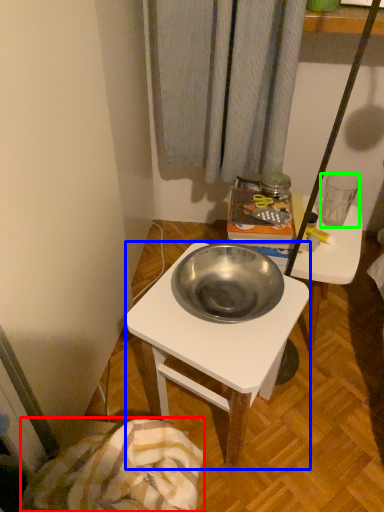
Question: Which object is the closest to the blanket (highlighted by a red box)? Choose among these: desk (highlighted by a blue box) or coffee cup (highlighted by a green box).

Choices:
 (A) desk
 (B) coffee cup

Answer: (A)